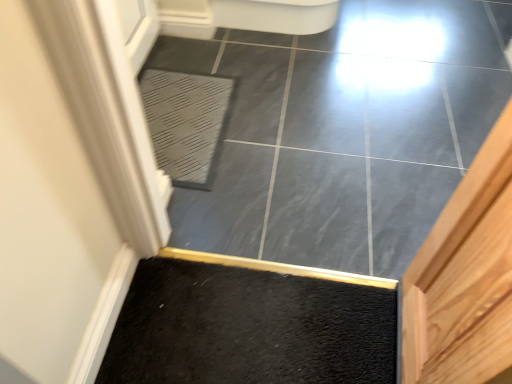
Question: Is the position of gray textured bath mat at center more distant than that of slate gray tile at center?

Choices:
 (A) yes
 (B) no

Answer: (A)

Question: Could slate gray tile at center be considered to be inside gray textured bath mat at center?

Choices:
 (A) no
 (B) yes

Answer: (A)

Question: From a real-world perspective, is gray textured bath mat at center beneath slate gray tile at center?

Choices:
 (A) yes
 (B) no

Answer: (B)

Question: Can you confirm if gray textured bath mat at center is bigger than slate gray tile at center?

Choices:
 (A) no
 (B) yes

Answer: (A)

Question: From the image's perspective, is gray textured bath mat at center on top of slate gray tile at center?

Choices:
 (A) yes
 (B) no

Answer: (B)

Question: Is gray textured bath mat at center to the right of slate gray tile at center from the viewer's perspective?

Choices:
 (A) no
 (B) yes

Answer: (A)

Question: Is slate gray tile at center thinner than gray textured bath mat at center?

Choices:
 (A) yes
 (B) no

Answer: (B)

Question: Considering the relative positions of slate gray tile at center and gray textured bath mat at center in the image provided, is slate gray tile at center behind gray textured bath mat at center?

Choices:
 (A) yes
 (B) no

Answer: (B)

Question: From a real-world perspective, is slate gray tile at center under gray textured bath mat at center?

Choices:
 (A) no
 (B) yes

Answer: (B)

Question: Is slate gray tile at center next to gray textured bath mat at center and touching it?

Choices:
 (A) yes
 (B) no

Answer: (B)

Question: Is slate gray tile at center surrounding gray textured bath mat at center?

Choices:
 (A) yes
 (B) no

Answer: (A)

Question: Considering the relative sizes of slate gray tile at center and gray textured bath mat at center in the image provided, is slate gray tile at center bigger than gray textured bath mat at center?

Choices:
 (A) yes
 (B) no

Answer: (A)

Question: Is gray textured bath mat at center inside the boundaries of slate gray tile at center, or outside?

Choices:
 (A) inside
 (B) outside

Answer: (A)